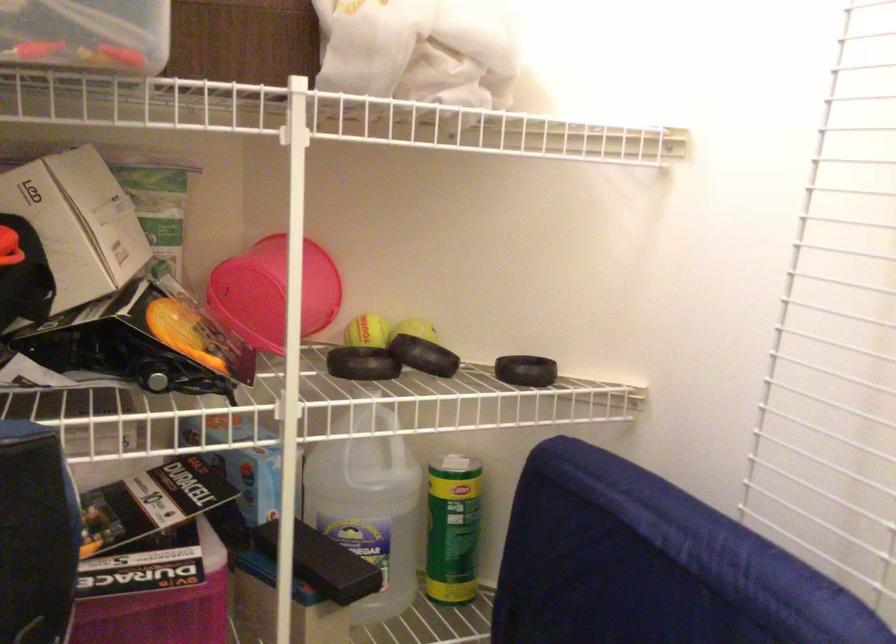
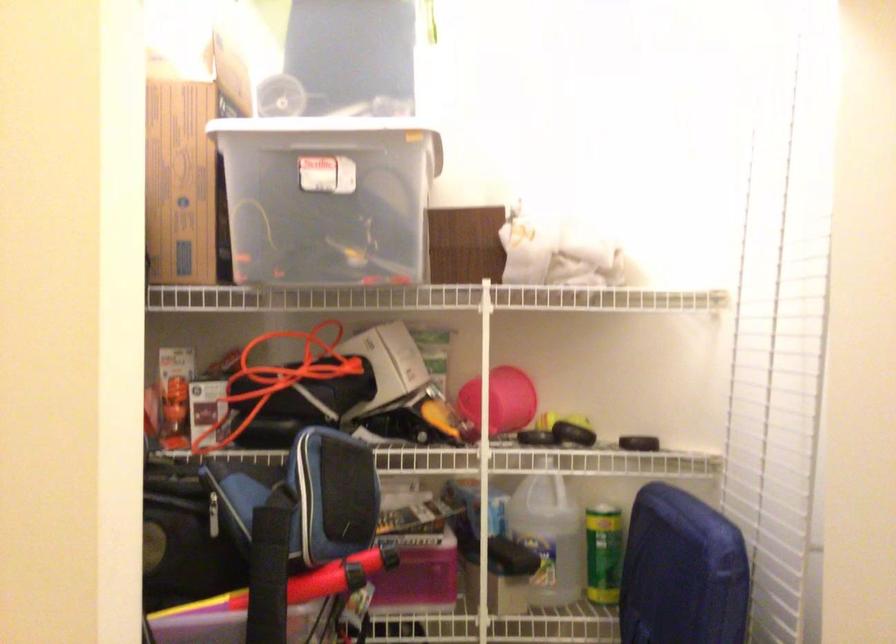
Find the pixel in the second image that matches (x=289, y=296) in the first image.

(500, 401)